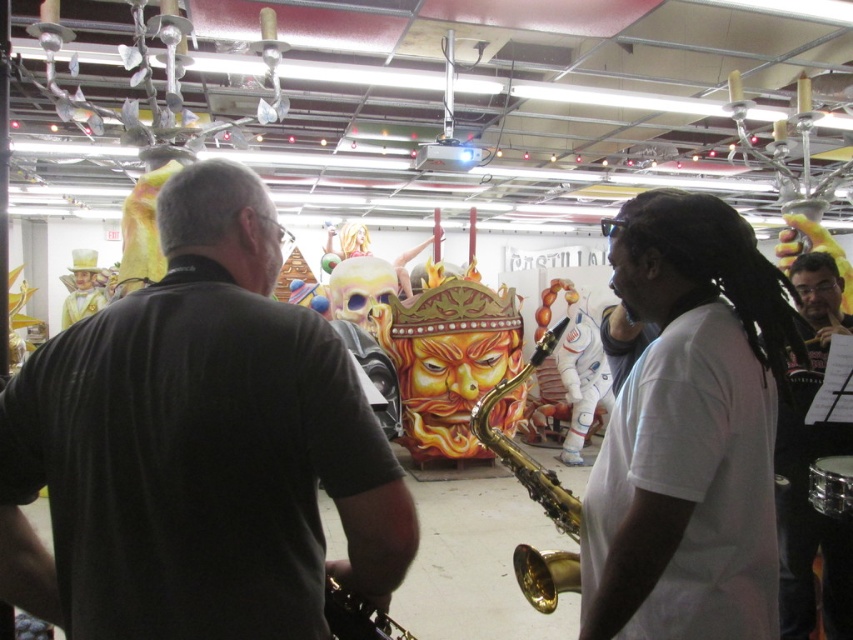
In the workshop scene, there is a point marked at coordinates [689,433]. What object is located at this coordinate?

The point at coordinates [689,433] marks the white matte t shirt at center.

You are standing in the studio and want to find the black matte shirt at center. Where should you look according to the coordinates provided?

The black matte shirt at center is located at coordinates point (198, 448).